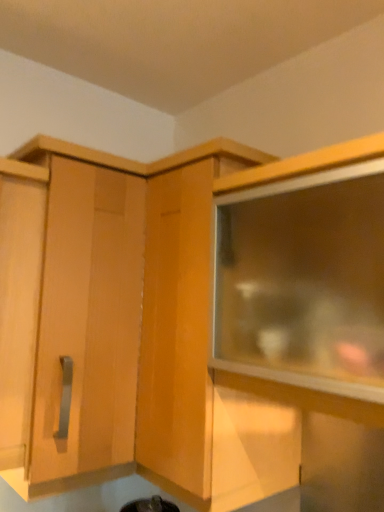
Question: Considering the relative positions of wooden cabinet at center, the 2th cabinetry viewed from the left, and transparent glass cabinet at upper right in the image provided, is wooden cabinet at center, the 2th cabinetry viewed from the left, to the left of transparent glass cabinet at upper right from the viewer's perspective?

Choices:
 (A) no
 (B) yes

Answer: (B)

Question: Is wooden cabinet at center, the 2th cabinetry viewed from the left, looking in the opposite direction of transparent glass cabinet at upper right?

Choices:
 (A) no
 (B) yes

Answer: (A)

Question: From a real-world perspective, does wooden cabinet at center, the 1th cabinetry viewed from the right, stand above transparent glass cabinet at upper right?

Choices:
 (A) no
 (B) yes

Answer: (A)

Question: Considering the relative positions of wooden cabinet at center, the 1th cabinetry viewed from the right, and transparent glass cabinet at upper right in the image provided, is wooden cabinet at center, the 1th cabinetry viewed from the right, to the right of transparent glass cabinet at upper right from the viewer's perspective?

Choices:
 (A) no
 (B) yes

Answer: (A)

Question: Is the depth of wooden cabinet at center, the 1th cabinetry viewed from the right, less than that of transparent glass cabinet at upper right?

Choices:
 (A) no
 (B) yes

Answer: (A)

Question: Is transparent glass cabinet at upper right taller or shorter than matte wood cabinet at upper left, placed as the first cabinetry when sorted from left to right?

Choices:
 (A) tall
 (B) short

Answer: (B)

Question: In terms of width, does transparent glass cabinet at upper right look wider or thinner when compared to matte wood cabinet at upper left, the 2th cabinetry viewed from the right?

Choices:
 (A) thin
 (B) wide

Answer: (A)

Question: Is transparent glass cabinet at upper right bigger or smaller than matte wood cabinet at upper left, the 2th cabinetry viewed from the right?

Choices:
 (A) small
 (B) big

Answer: (A)

Question: Is transparent glass cabinet at upper right in front of or behind matte wood cabinet at upper left, the 2th cabinetry viewed from the right, in the image?

Choices:
 (A) front
 (B) behind

Answer: (A)

Question: In terms of size, does wooden cabinet at center, the 2th cabinetry viewed from the left, appear bigger or smaller than transparent glass cabinet at upper right?

Choices:
 (A) small
 (B) big

Answer: (B)

Question: In terms of height, does wooden cabinet at center, the 1th cabinetry viewed from the right, look taller or shorter compared to transparent glass cabinet at upper right?

Choices:
 (A) tall
 (B) short

Answer: (A)

Question: In the image, is wooden cabinet at center, the 2th cabinetry viewed from the left, on the left side or the right side of transparent glass cabinet at upper right?

Choices:
 (A) right
 (B) left

Answer: (B)

Question: From the image's perspective, relative to transparent glass cabinet at upper right, is wooden cabinet at center, the 2th cabinetry viewed from the left, above or below?

Choices:
 (A) below
 (B) above

Answer: (A)

Question: Is matte wood cabinet at upper left, placed as the first cabinetry when sorted from left to right, to the left or to the right of wooden cabinet at center, the 1th cabinetry viewed from the right, in the image?

Choices:
 (A) right
 (B) left

Answer: (B)

Question: From the image's perspective, is matte wood cabinet at upper left, the 2th cabinetry viewed from the right, positioned above or below wooden cabinet at center, the 2th cabinetry viewed from the left?

Choices:
 (A) below
 (B) above

Answer: (B)